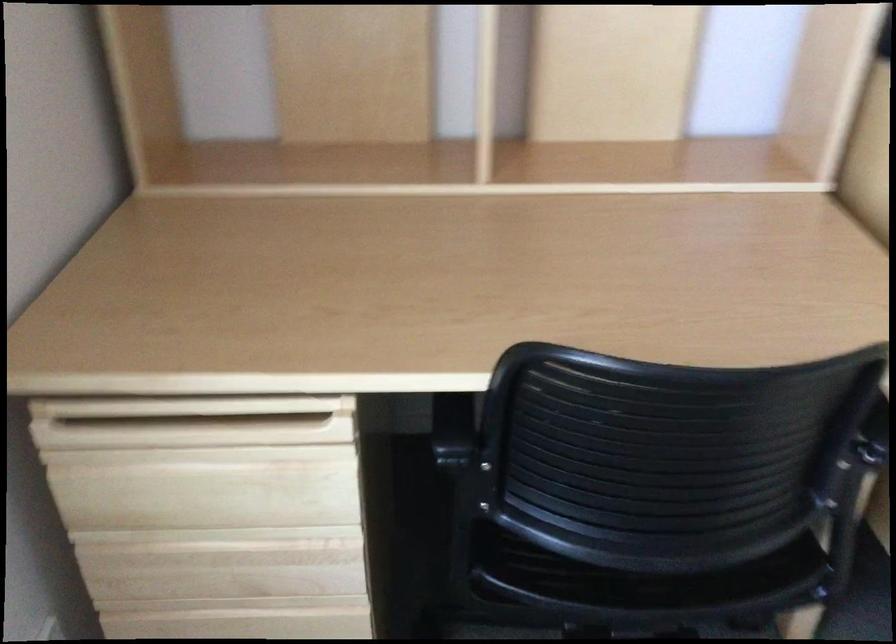
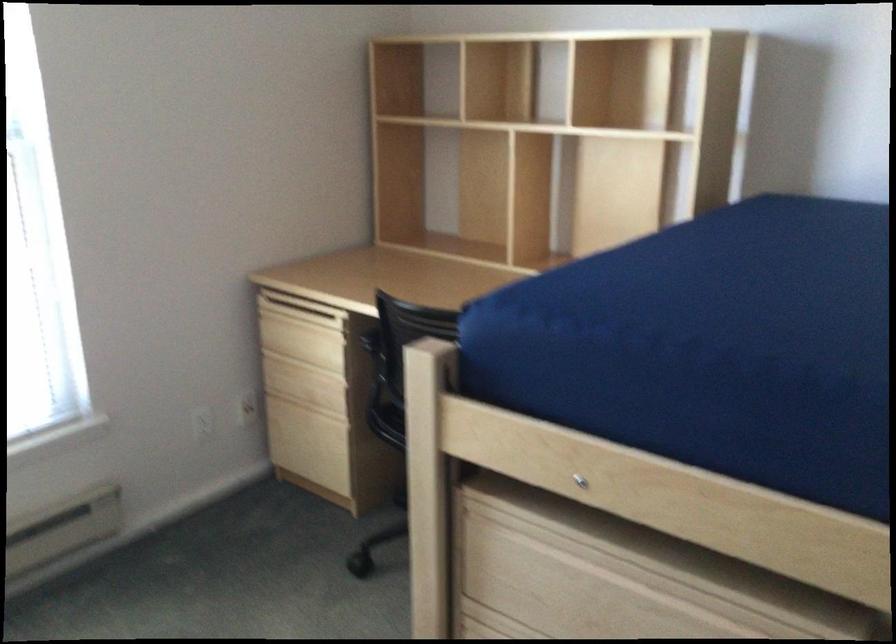
Where in the second image is the point corresponding to the point at 150,458 from the first image?

(285, 319)